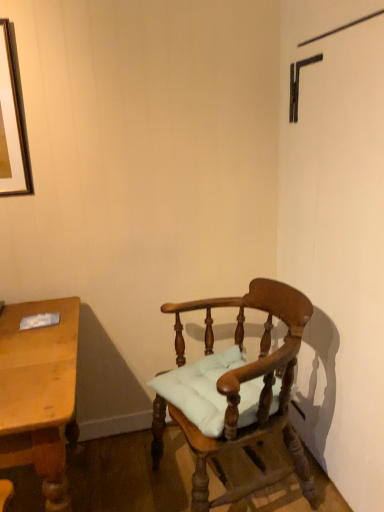
Question: Can you confirm if light brown wooden desk at left is smaller than wooden chair with cushion at center?

Choices:
 (A) yes
 (B) no

Answer: (A)

Question: From the image's perspective, is light brown wooden desk at left on wooden chair with cushion at center?

Choices:
 (A) yes
 (B) no

Answer: (B)

Question: Could you tell me if light brown wooden desk at left is facing wooden chair with cushion at center?

Choices:
 (A) no
 (B) yes

Answer: (A)

Question: Are light brown wooden desk at left and wooden chair with cushion at center beside each other?

Choices:
 (A) yes
 (B) no

Answer: (B)

Question: Does light brown wooden desk at left have a larger size compared to wooden chair with cushion at center?

Choices:
 (A) no
 (B) yes

Answer: (A)

Question: From the image's perspective, is light brown wooden desk at left located beneath wooden chair with cushion at center?

Choices:
 (A) no
 (B) yes

Answer: (B)

Question: Is wooden chair with cushion at center touching light brown wooden desk at left?

Choices:
 (A) yes
 (B) no

Answer: (B)

Question: Is wooden chair with cushion at center not inside light brown wooden desk at left?

Choices:
 (A) yes
 (B) no

Answer: (A)

Question: Are wooden chair with cushion at center and light brown wooden desk at left far apart?

Choices:
 (A) yes
 (B) no

Answer: (B)

Question: Can you confirm if wooden chair with cushion at center is taller than light brown wooden desk at left?

Choices:
 (A) yes
 (B) no

Answer: (A)

Question: From a real-world perspective, is wooden chair with cushion at center on light brown wooden desk at left?

Choices:
 (A) yes
 (B) no

Answer: (A)

Question: Considering the relative positions of wooden chair with cushion at center and light brown wooden desk at left in the image provided, is wooden chair with cushion at center behind light brown wooden desk at left?

Choices:
 (A) yes
 (B) no

Answer: (A)

Question: Is light brown wooden desk at left wider or thinner than wooden chair with cushion at center?

Choices:
 (A) wide
 (B) thin

Answer: (A)